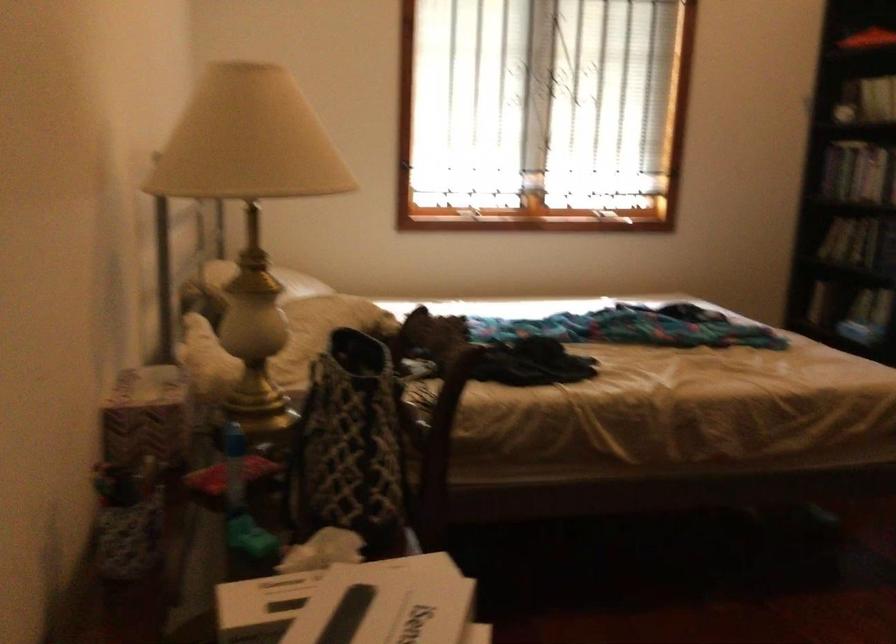
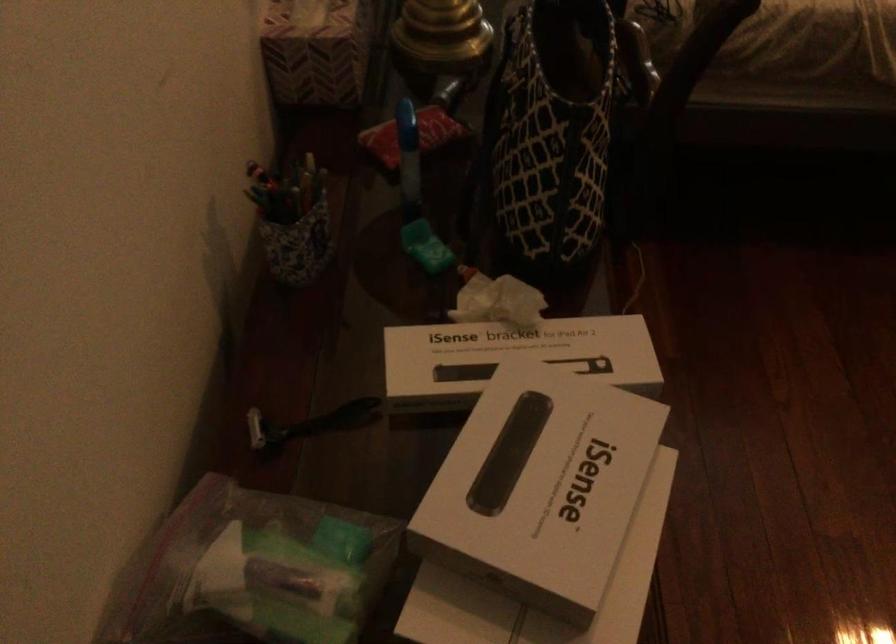
Locate, in the second image, the point that corresponds to the point at 131,502 in the first image.

(291, 220)